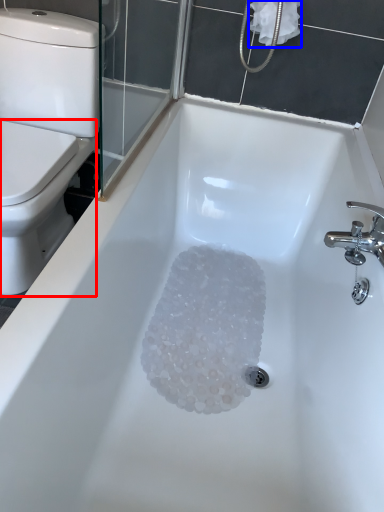
Question: Which of the following is the farthest to the observer, bidet (highlighted by a red box) or toilet paper (highlighted by a blue box)?

Choices:
 (A) bidet
 (B) toilet paper

Answer: (B)